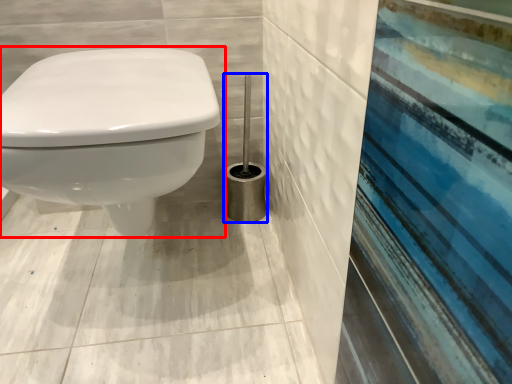
Question: Which object appears farthest to the camera in this image, toilet (highlighted by a red box) or brush (highlighted by a blue box)?

Choices:
 (A) toilet
 (B) brush

Answer: (B)